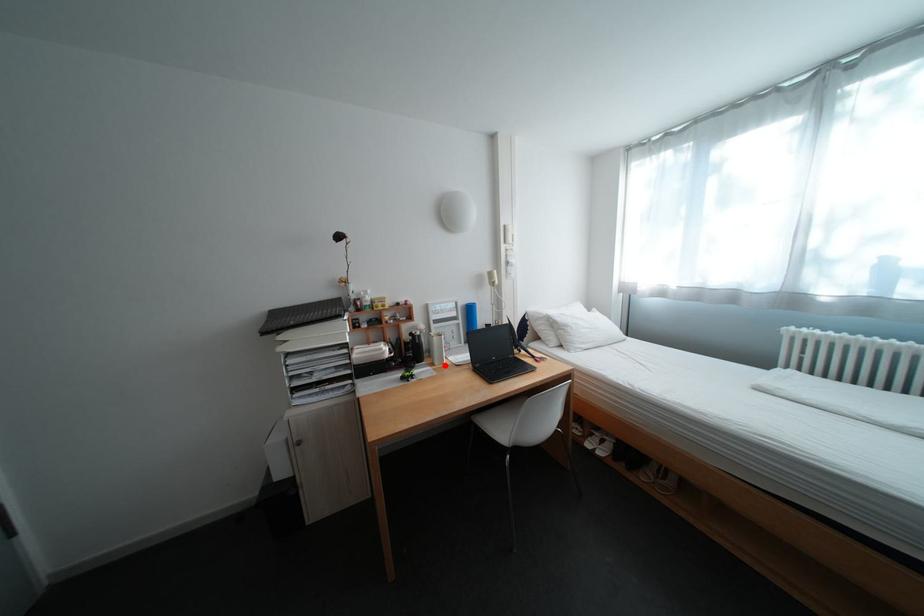
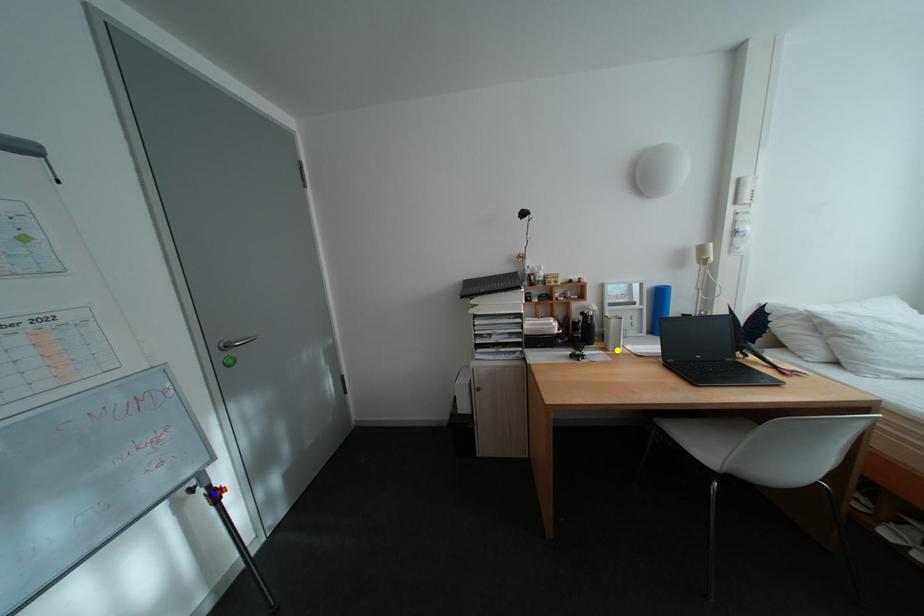
Question: I am providing you with two images of the same scene from different viewpoints. A red point is marked on the first image. You are given multiple points on the second image. Can you choose the point in image 2 that corresponds to the point in image 1?

Choices:
 (A) green point
 (B) blue point
 (C) yellow point

Answer: (C)